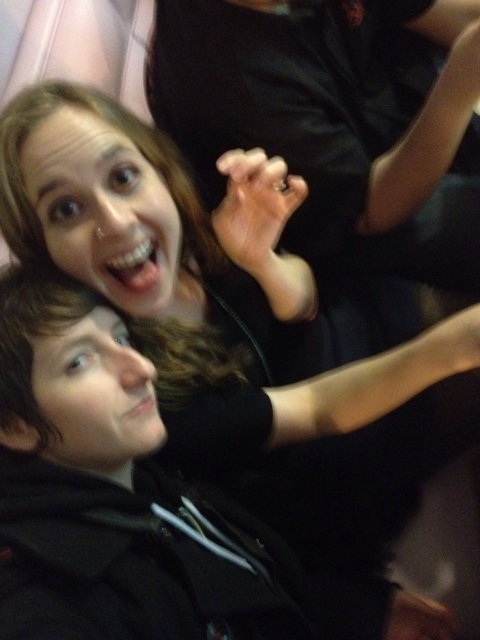
Question: Which point is farther to the camera?

Choices:
 (A) (188, 522)
 (B) (298, 115)

Answer: (B)

Question: Which point is closer to the camera?

Choices:
 (A) matte black hand at center
 (B) black hoodie at lower left

Answer: (B)

Question: Where is matte black hand at center located in relation to black hoodie at lower left in the image?

Choices:
 (A) right
 (B) left

Answer: (A)

Question: Does matte black hand at center come behind black hoodie at lower left?

Choices:
 (A) yes
 (B) no

Answer: (A)

Question: Can you confirm if matte black hand at center is positioned above black hoodie at lower left?

Choices:
 (A) yes
 (B) no

Answer: (A)

Question: Which point appears farthest from the camera in this image?

Choices:
 (A) (380, 51)
 (B) (144, 608)

Answer: (A)